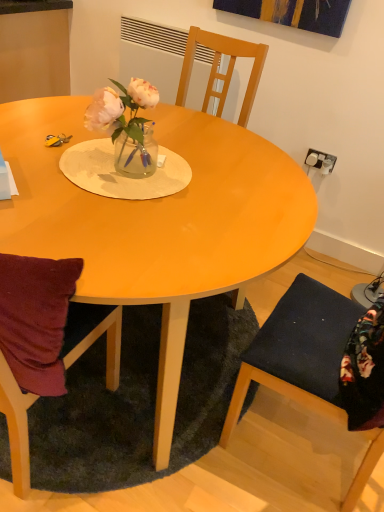
Question: Can translucent glass vase at center be found inside dark blue fabric chair at lower right?

Choices:
 (A) no
 (B) yes

Answer: (A)

Question: Is dark blue fabric chair at lower right further to camera compared to translucent glass vase at center?

Choices:
 (A) no
 (B) yes

Answer: (A)

Question: Does dark blue fabric chair at lower right have a lesser width compared to translucent glass vase at center?

Choices:
 (A) yes
 (B) no

Answer: (B)

Question: Does dark blue fabric chair at lower right turn towards translucent glass vase at center?

Choices:
 (A) no
 (B) yes

Answer: (B)

Question: Is dark blue fabric chair at lower right far from translucent glass vase at center?

Choices:
 (A) yes
 (B) no

Answer: (B)

Question: Does dark blue fabric chair at lower right have a greater width compared to translucent glass vase at center?

Choices:
 (A) yes
 (B) no

Answer: (A)

Question: From a real-world perspective, is matte wood table at center positioned over dark blue fabric chair at lower right based on gravity?

Choices:
 (A) yes
 (B) no

Answer: (B)

Question: Would you say dark blue fabric chair at lower right is part of matte wood table at center's contents?

Choices:
 (A) no
 (B) yes

Answer: (A)

Question: Is matte wood table at center positioned with its back to dark blue fabric chair at lower right?

Choices:
 (A) no
 (B) yes

Answer: (A)

Question: Can you confirm if matte wood table at center is positioned to the left of dark blue fabric chair at lower right?

Choices:
 (A) yes
 (B) no

Answer: (A)

Question: Would you say matte wood table at center is outside dark blue fabric chair at lower right?

Choices:
 (A) yes
 (B) no

Answer: (A)

Question: Are matte wood table at center and dark blue fabric chair at lower right far apart?

Choices:
 (A) yes
 (B) no

Answer: (B)

Question: Does dark green shaggy rug at lower center have a greater width compared to translucent glass vase at center?

Choices:
 (A) no
 (B) yes

Answer: (B)